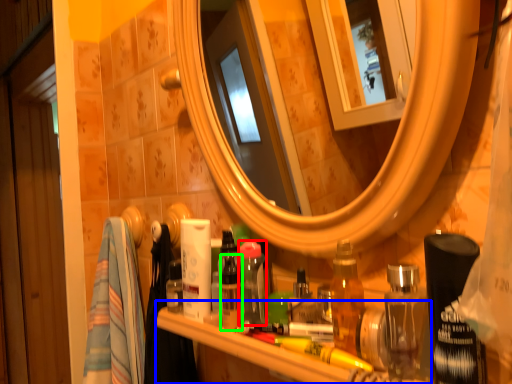
Question: Based on their relative distances, which object is nearer to toiletry (highlighted by a red box)? Choose from counter (highlighted by a blue box) and toiletry (highlighted by a green box).

Choices:
 (A) counter
 (B) toiletry

Answer: (B)